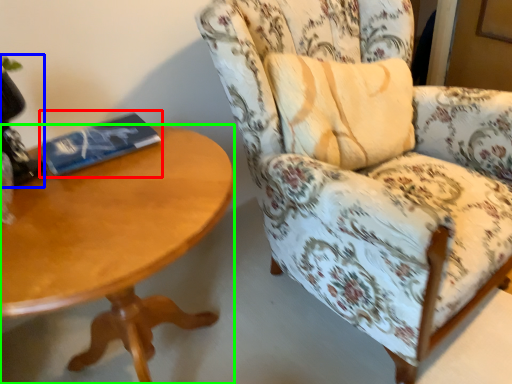
Question: Which is farther away from paperback book (highlighted by a red box)? table lamp (highlighted by a blue box) or coffee table (highlighted by a green box)?

Choices:
 (A) table lamp
 (B) coffee table

Answer: (B)